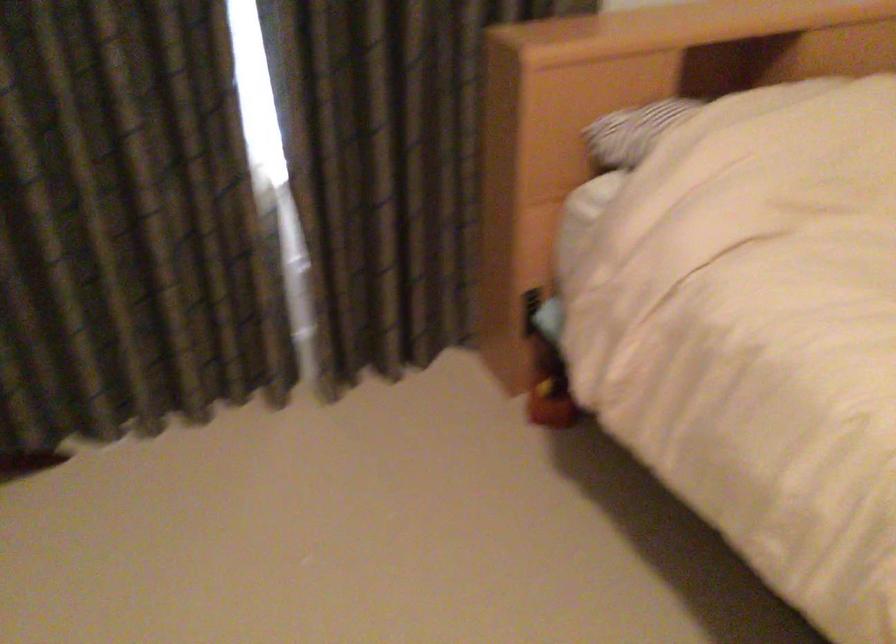
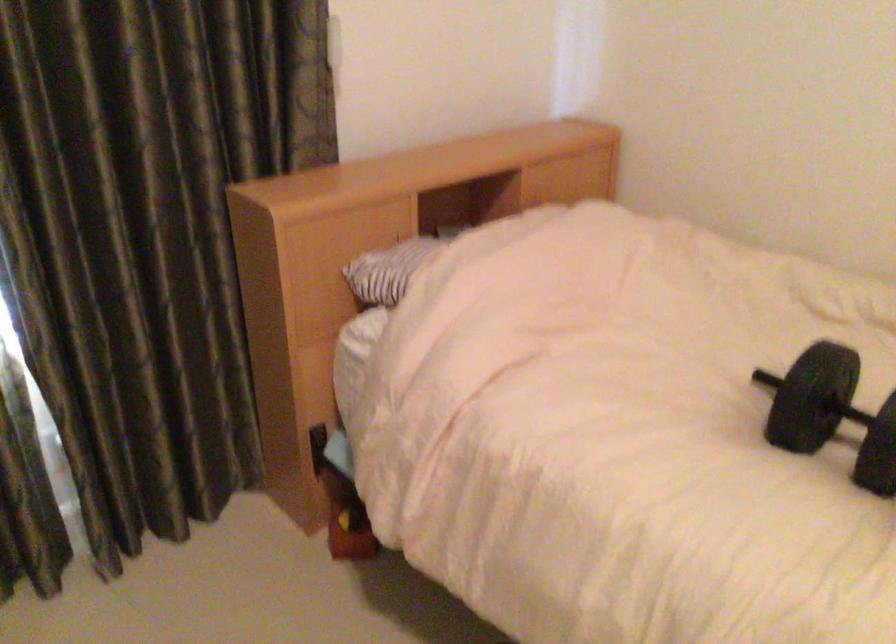
Question: How did the camera likely rotate?

Choices:
 (A) Left
 (B) Right
 (C) Up
 (D) Down

Answer: (B)